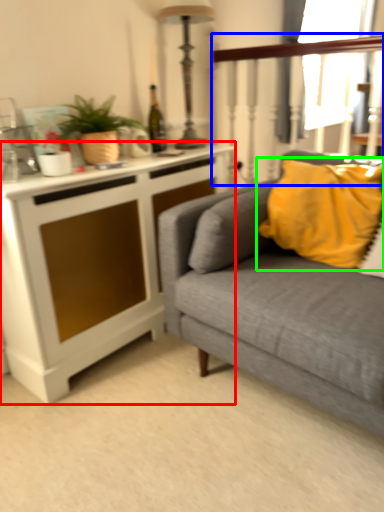
Question: Which is nearer to the cabinetry (highlighted by a red box)? rail (highlighted by a blue box) or pillow (highlighted by a green box).

Choices:
 (A) rail
 (B) pillow

Answer: (B)